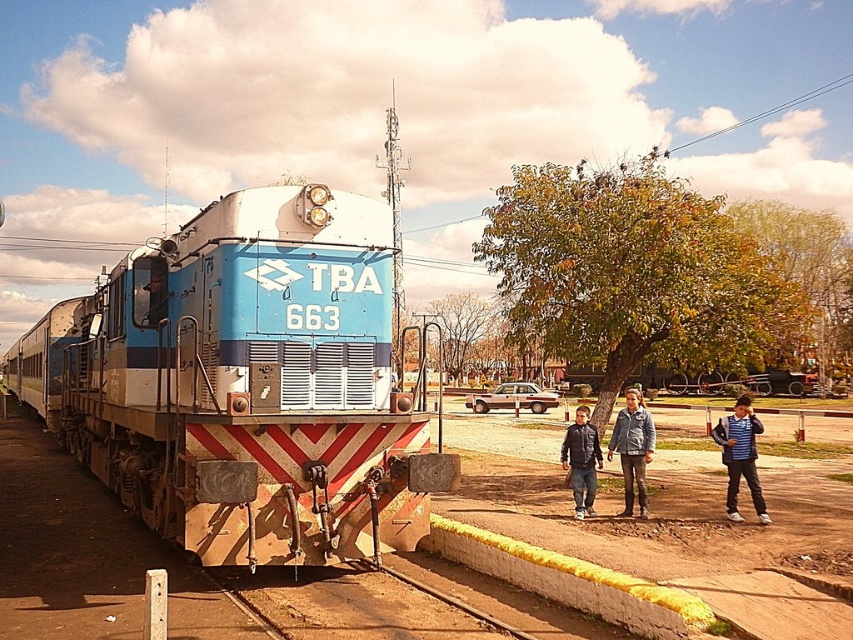
Question: Does brown dirt train track at lower center appear on the left side of leather jacket at center?

Choices:
 (A) no
 (B) yes

Answer: (B)

Question: Can you confirm if striped shirt at lower right is smaller than matte brown sedan at center?

Choices:
 (A) yes
 (B) no

Answer: (B)

Question: Which of the following is the closest to the observer?

Choices:
 (A) (494, 404)
 (B) (123, 301)
 (C) (386, 604)

Answer: (C)

Question: Which point appears farthest from the camera in this image?

Choices:
 (A) (323, 243)
 (B) (734, 472)
 (C) (598, 461)
 (D) (640, 460)

Answer: (C)

Question: Can you confirm if blue matte train at left is positioned to the left of matte brown sedan at center?

Choices:
 (A) yes
 (B) no

Answer: (A)

Question: Which of the following is the closest to the observer?

Choices:
 (A) (630, 424)
 (B) (352, 461)
 (C) (590, 433)

Answer: (B)